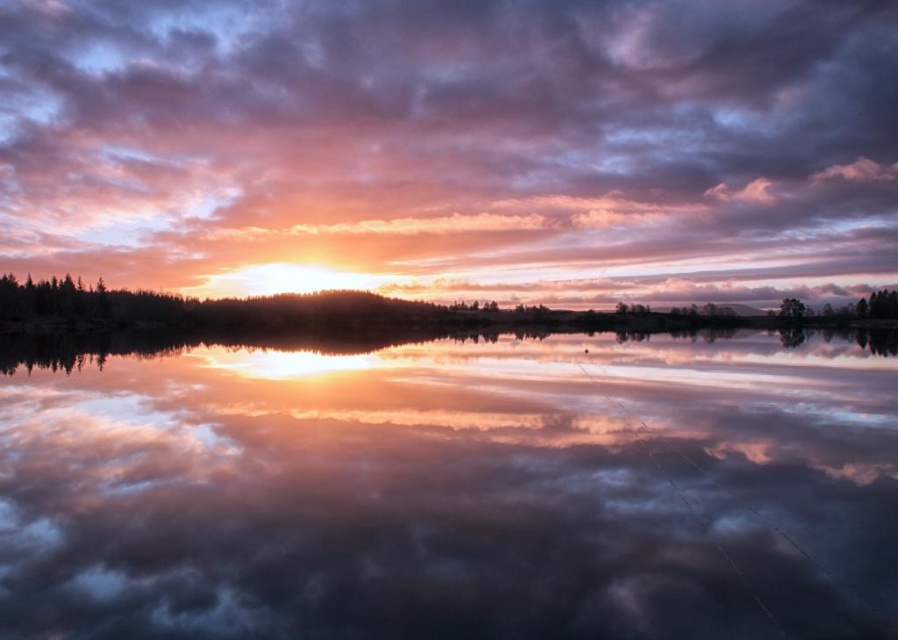
Looking at this image, you are standing at the edge of the water in the sunset scene. There are two points marked in the image. The first point is at coordinates point (x=113, y=621) and the second is at point (x=879, y=317). If you want to walk towards the point that is closer to you, which point should you head towards?

You should head towards point (x=113, y=621) because it is in front of point (x=879, y=317), meaning it is closer to your current position at the edge of the water.

You are a photographer standing at the edge of the water. You want to capture a photo that includes both the reflective water at center and the green matte trees at center. Given that your camera can focus on objects up to 150 meters away, will you be able to capture both in a single shot without moving?

The reflective water at center and green matte trees at center are 167.11 meters apart. Since your camera can only focus up to 150 meters, you will not be able to capture both in a single shot without moving.